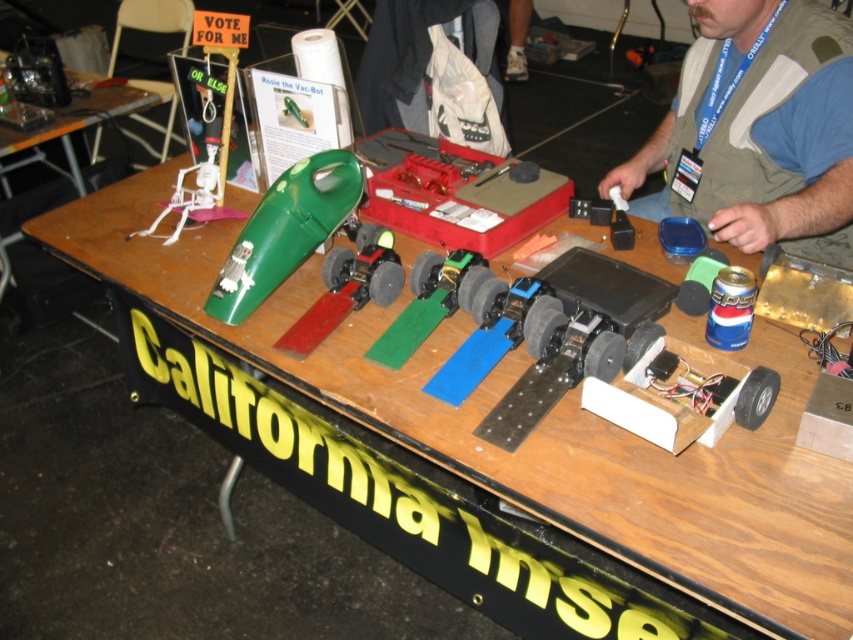
You are a judge at the competition and need to inspect the green matte vacuum cleaner at center and the white plastic skeleton at upper left. Which object should you examine first if you want to start with the one closer to you?

The green matte vacuum cleaner at center is closer to the viewer than the white plastic skeleton at upper left, so you should examine the green matte vacuum cleaner at center first.

You are a participant at the competition and need to place a 1.2 meter long banner between the brown fabric vest at upper right and the white plastic skeleton at upper left. Will the banner fit between them?

The distance between the brown fabric vest at upper right and the white plastic skeleton at upper left is 1.02 meters. Since the banner is 1.2 meters long, it is longer than the available space. Therefore, the banner will not fit between them.

You are a participant at the competition and need to place a new item between the brown fabric vest at upper right and the green matte vacuum cleaner at center. The item is 15 inches long. Will there be enough space between them to place the item without moving either object?

The distance between the brown fabric vest at upper right and the green matte vacuum cleaner at center is 30.68 inches. Since the new item is 15 inches long, there is sufficient space to place it between them without moving either object.